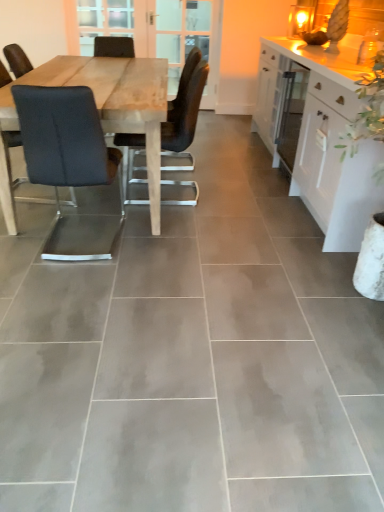
Identify the location of free space to the left of black fabric chair at left, positioned as the second chair in right-to-left order. (32, 233).